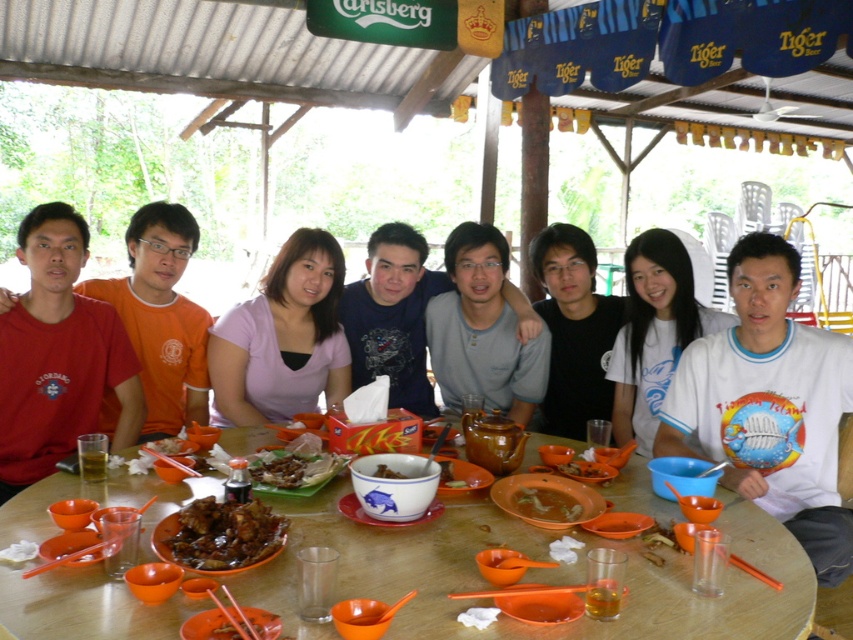
Question: Among these points, which one is nearest to the camera?

Choices:
 (A) (593, 417)
 (B) (248, 380)
 (C) (514, 502)
 (D) (94, 374)

Answer: (C)

Question: Based on their relative distances, which object is farther from the black matte shirt at center?

Choices:
 (A) brown matte bowl at center
 (B) white cotton t-shirt at center

Answer: (A)

Question: Among these objects, which one is nearest to the camera?

Choices:
 (A) brown matte soup bowl at center
 (B) wooden table at center
 (C) matte red shirt at left
 (D) white cotton shirt at center

Answer: (B)

Question: Is wooden table at center smaller than brown matte bowl at center?

Choices:
 (A) yes
 (B) no

Answer: (B)

Question: Is wooden table at center bigger than brown matte fried chicken at center?

Choices:
 (A) no
 (B) yes

Answer: (B)

Question: Does matte red shirt at left have a smaller size compared to brown matte soup bowl at center?

Choices:
 (A) no
 (B) yes

Answer: (A)